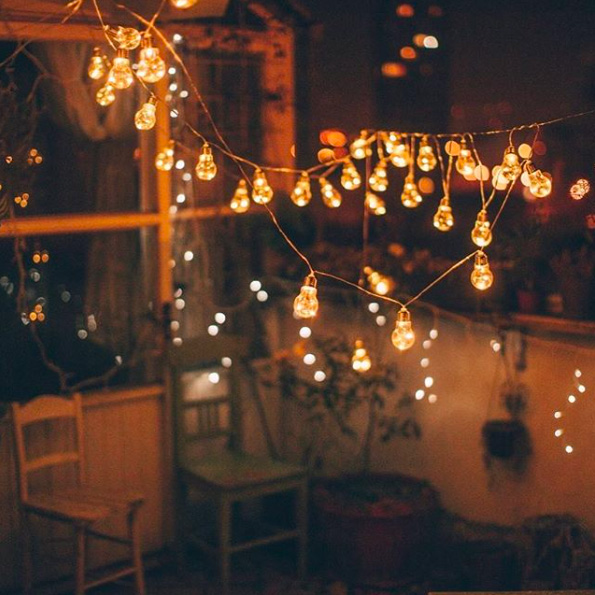
Locate an element on the screen. The image size is (595, 595). string lights is located at coordinates click(343, 162).